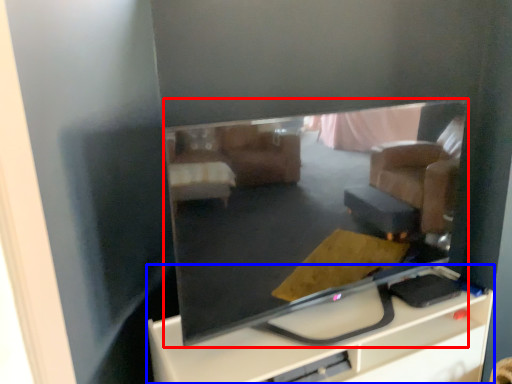
Question: Which point is further to the camera, television (highlighted by a red box) or furniture (highlighted by a blue box)?

Choices:
 (A) television
 (B) furniture

Answer: (B)